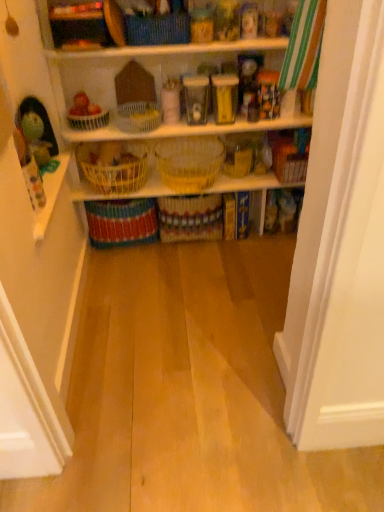
Question: Considering the relative positions of white wicker basket at center, positioned as the fifth basket in bottom-to-top order, and yellow wicker baskets at center in the image provided, is white wicker basket at center, positioned as the fifth basket in bottom-to-top order, to the right of yellow wicker baskets at center from the viewer's perspective?

Choices:
 (A) no
 (B) yes

Answer: (A)

Question: From the image's perspective, is white wicker basket at center, the third basket when ordered from top to bottom, under yellow wicker baskets at center?

Choices:
 (A) yes
 (B) no

Answer: (B)

Question: Considering the relative sizes of white wicker basket at center, the third basket when ordered from top to bottom, and yellow wicker baskets at center in the image provided, is white wicker basket at center, the third basket when ordered from top to bottom, taller than yellow wicker baskets at center?

Choices:
 (A) yes
 (B) no

Answer: (A)

Question: Is yellow wicker baskets at center located within white wicker basket at center, the third basket when ordered from top to bottom?

Choices:
 (A) no
 (B) yes

Answer: (A)

Question: Considering the relative sizes of white wicker basket at center, the third basket when ordered from top to bottom, and yellow wicker baskets at center in the image provided, is white wicker basket at center, the third basket when ordered from top to bottom, shorter than yellow wicker baskets at center?

Choices:
 (A) yes
 (B) no

Answer: (B)

Question: Based on their positions, is multicolored woven basket at center, which is the first basket in bottom-to-top order, located to the left or right of yellow wicker basket at center, the third basket in the bottom-to-top sequence?

Choices:
 (A) left
 (B) right

Answer: (A)

Question: From the image's perspective, relative to yellow wicker basket at center, which is the 5th basket from top to bottom, is multicolored woven basket at center, which is the first basket in bottom-to-top order, above or below?

Choices:
 (A) below
 (B) above

Answer: (A)

Question: Relative to yellow wicker basket at center, the third basket in the bottom-to-top sequence, is multicolored woven basket at center, the seventh basket when ordered from top to bottom, in front or behind?

Choices:
 (A) behind
 (B) front

Answer: (A)

Question: From a real-world perspective, is multicolored woven basket at center, the seventh basket when ordered from top to bottom, positioned above or below yellow wicker basket at center, which is the 5th basket from top to bottom?

Choices:
 (A) above
 (B) below

Answer: (B)

Question: From their relative heights in the image, would you say yellow wicker basket at center, the third basket in the bottom-to-top sequence, is taller or shorter than yellow woven basket at center, which appears as the second basket when ordered from the bottom?

Choices:
 (A) tall
 (B) short

Answer: (B)

Question: Is point (127, 168) closer or farther from the camera than point (208, 210)?

Choices:
 (A) closer
 (B) farther

Answer: (A)

Question: From the image's perspective, is yellow wicker basket at center, which is the 5th basket from top to bottom, located above or below yellow woven basket at center, which appears as the second basket when ordered from the bottom?

Choices:
 (A) above
 (B) below

Answer: (A)

Question: Considering their positions, is yellow wicker basket at center, the third basket in the bottom-to-top sequence, located in front of or behind yellow woven basket at center, which appears as the second basket when ordered from the bottom?

Choices:
 (A) behind
 (B) front

Answer: (B)

Question: Relative to multicolored woven basket at center, which is the first basket in bottom-to-top order, is yellow wicker basket at center, the third basket in the bottom-to-top sequence, in front or behind?

Choices:
 (A) front
 (B) behind

Answer: (A)

Question: From a real-world perspective, is yellow wicker basket at center, which is the 5th basket from top to bottom, physically located above or below multicolored woven basket at center, which is the first basket in bottom-to-top order?

Choices:
 (A) above
 (B) below

Answer: (A)